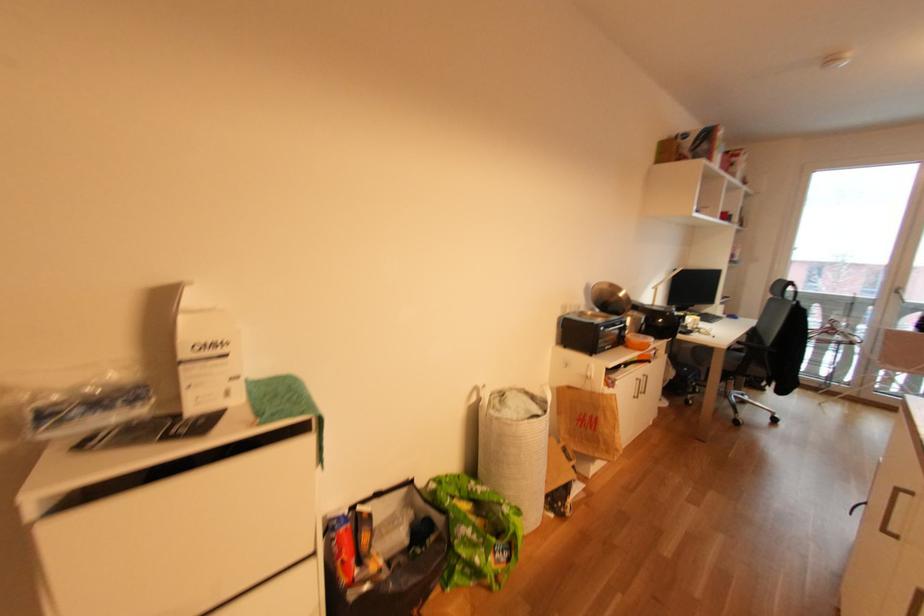
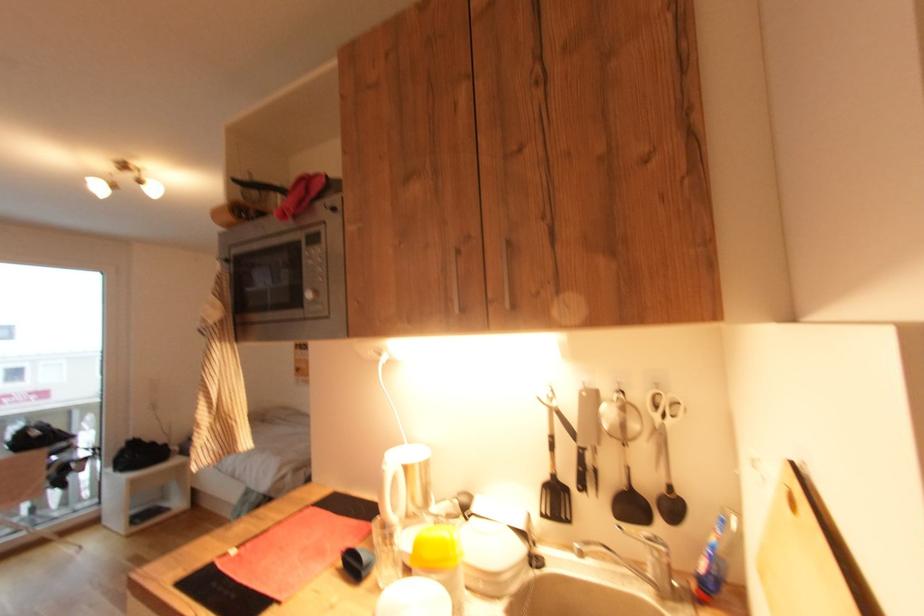
Question: The first image is from the beginning of the video and the second image is from the end. How did the camera likely rotate when shooting the video?

Choices:
 (A) Left
 (B) Right
 (C) Up
 (D) Down

Answer: (B)